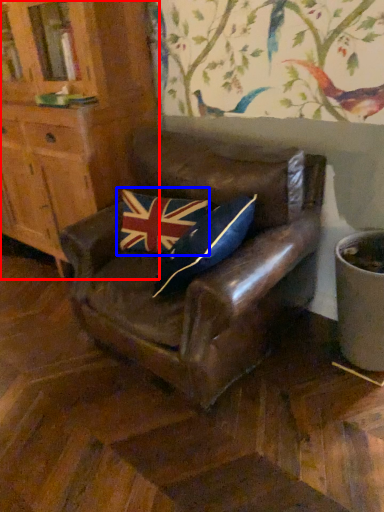
Question: Which of the following is the closest to the observer, cabinetry (highlighted by a red box) or flag (highlighted by a blue box)?

Choices:
 (A) cabinetry
 (B) flag

Answer: (A)